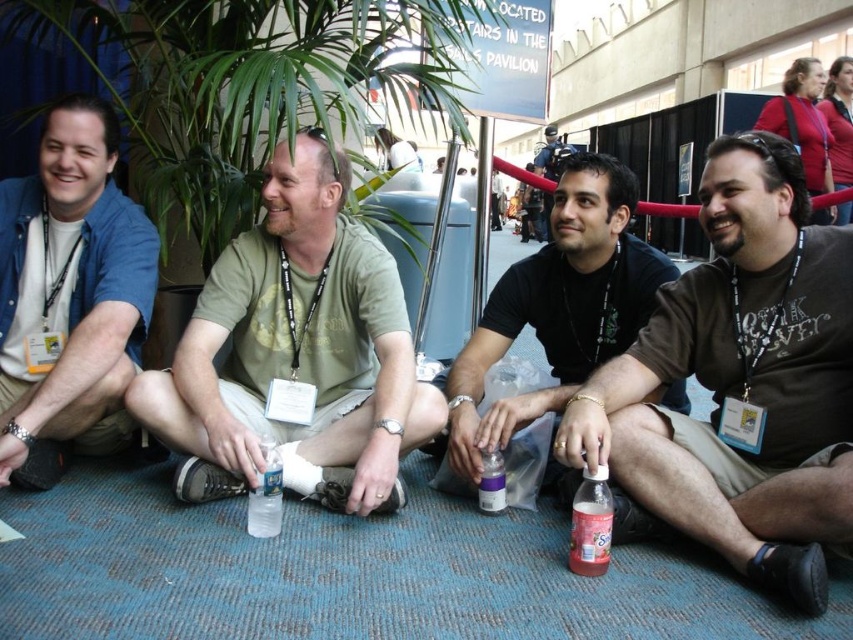
Question: Is green cotton shirt at center further to the viewer compared to matte black t-shirt at center?

Choices:
 (A) no
 (B) yes

Answer: (A)

Question: Can you confirm if matte blue shirt at left is positioned below purple matte bottle at center?

Choices:
 (A) yes
 (B) no

Answer: (B)

Question: Which of the following is the closest to the observer?

Choices:
 (A) pink plastic bottle at lower right
 (B) matte blue shirt at left
 (C) brown cotton shirt at lower right

Answer: (C)

Question: Does brown cotton shirt at lower right come in front of purple matte bottle at center?

Choices:
 (A) no
 (B) yes

Answer: (B)

Question: Considering the real-world distances, which object is farthest from the brown cotton shirt at lower right?

Choices:
 (A) matte blue shirt at left
 (B) pink plastic bottle at lower right
 (C) clear plastic bottle at center
 (D) green cotton shirt at center

Answer: (A)

Question: Which is farther from the matte black t-shirt at center?

Choices:
 (A) clear plastic bottle at center
 (B) pink plastic bottle at lower right

Answer: (A)